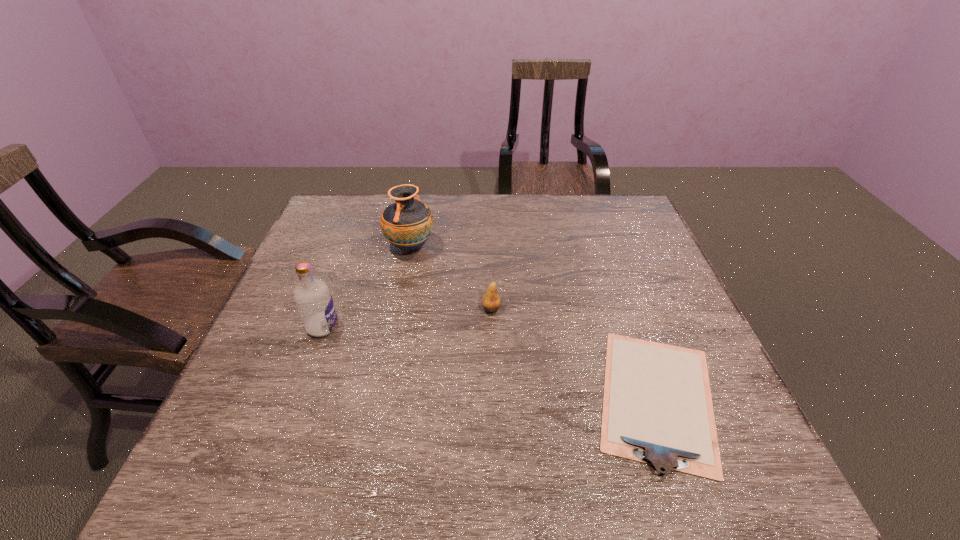
In order to click on free space between the second shortest object and the clipboard in this screenshot , I will do `click(574, 353)`.

Where is `vacant region between the pottery and the shortest object`? Image resolution: width=960 pixels, height=540 pixels. vacant region between the pottery and the shortest object is located at coordinates (534, 322).

Select which object is the second closest to the rightmost object. Please provide its 2D coordinates. Your answer should be formatted as a tuple, i.e. [(x, y)], where the tuple contains the x and y coordinates of a point satisfying the conditions above.

[(407, 224)]

At what (x,y) coordinates should I click in order to perform the action: click on object that can be found as the closest to the leftmost object. Please return your answer as a coordinate pair (x, y). The width and height of the screenshot is (960, 540). Looking at the image, I should click on (407, 224).

Identify the location of vacant space that satisfies the following two spatial constraints: 1. on the label of the vodka; 2. on the left side of the clipboard. This screenshot has width=960, height=540. (297, 398).

Locate an element on the screen. This screenshot has height=540, width=960. vacant space that satisfies the following two spatial constraints: 1. on the back side of the shortest object; 2. on the label of the leftmost object is located at coordinates (633, 327).

The height and width of the screenshot is (540, 960). In order to click on vacant position in the image that satisfies the following two spatial constraints: 1. on the front side of the farthest object; 2. on the label of the leftmost object in this screenshot , I will do `click(394, 327)`.

Locate an element on the screen. The height and width of the screenshot is (540, 960). free point that satisfies the following two spatial constraints: 1. on the front side of the rightmost object; 2. on the left side of the pottery is located at coordinates (380, 398).